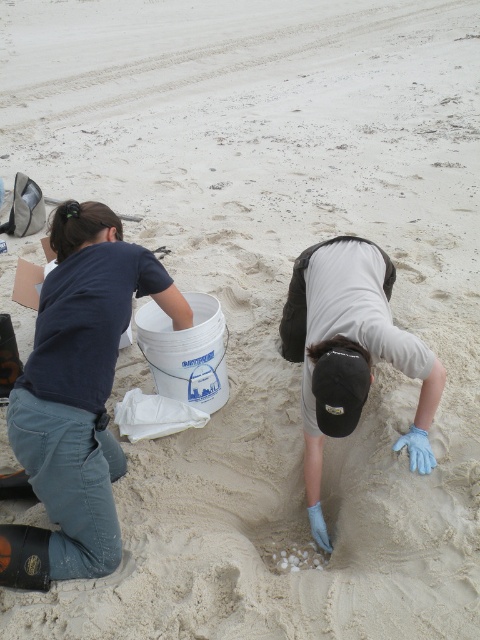
Does dark blue fabric squat at left have a smaller size compared to blue latex gloves at lower center?

Correct, dark blue fabric squat at left occupies less space than blue latex gloves at lower center.

Which is behind, point (111, 561) or point (405, 372)?

The point (405, 372) is more distant.

Between point (94, 529) and point (300, 346), which one is positioned in front?

Positioned in front is point (94, 529).

This screenshot has width=480, height=640. I want to click on dark blue fabric squat at left, so click(x=76, y=396).